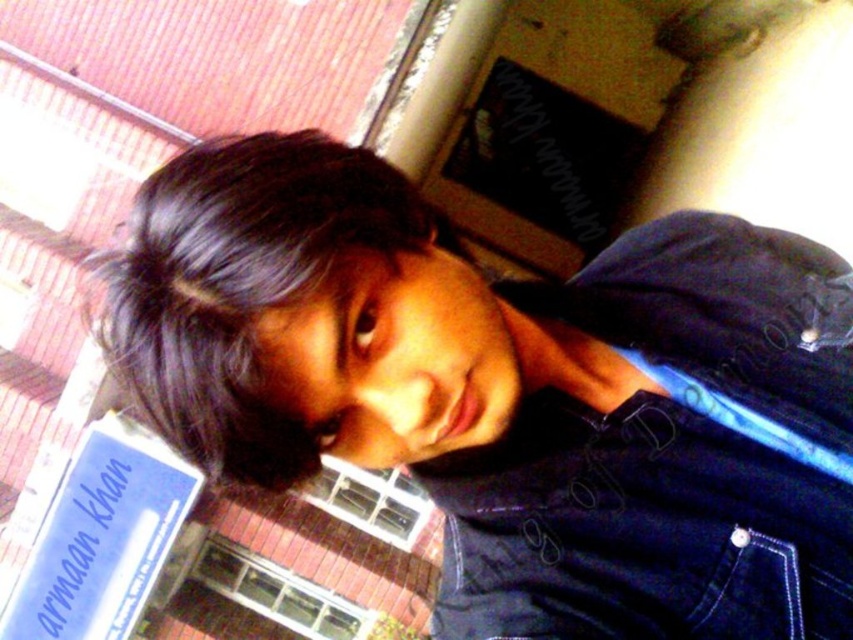
Is dark blue denim jacket at upper right above navy blue denim jacket at lower right?

Incorrect, dark blue denim jacket at upper right is not positioned above navy blue denim jacket at lower right.

The height and width of the screenshot is (640, 853). What do you see at coordinates (509, 392) in the screenshot?
I see `dark blue denim jacket at upper right` at bounding box center [509, 392].

Measure the distance between point (821, 552) and camera.

Point (821, 552) is 26.50 inches from camera.

The height and width of the screenshot is (640, 853). Find the location of `dark blue denim jacket at upper right`. dark blue denim jacket at upper right is located at coordinates (509, 392).

Does dark blue denim jacket at upper right have a greater height compared to dark brown hair at upper left?

Correct, dark blue denim jacket at upper right is much taller as dark brown hair at upper left.

Is dark blue denim jacket at upper right in front of dark brown hair at upper left?

No, it is behind dark brown hair at upper left.

I want to click on dark blue denim jacket at upper right, so click(509, 392).

Consider the image. Who is more forward, (730, 609) or (144, 298)?

Point (144, 298) is in front.

Does navy blue denim jacket at lower right have a greater width compared to dark brown hair at upper left?

Yes, navy blue denim jacket at lower right is wider than dark brown hair at upper left.

Which is in front, point (596, 600) or point (265, 307)?

Positioned in front is point (265, 307).

Identify the location of navy blue denim jacket at lower right. The image size is (853, 640). pyautogui.click(x=669, y=454).